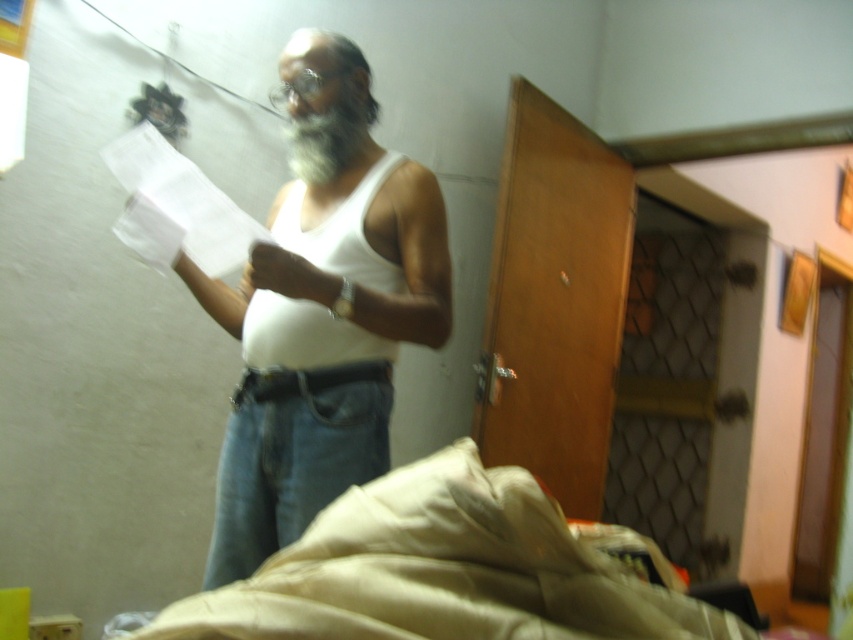
In the scene shown: Between beige fabric bed at lower center and matte white hand at center, which one appears on the right side from the viewer's perspective?

From the viewer's perspective, beige fabric bed at lower center appears more on the right side.

Find the location of a particular element. Image resolution: width=853 pixels, height=640 pixels. beige fabric bed at lower center is located at coordinates (451, 570).

Where is `beige fabric bed at lower center`? The image size is (853, 640). beige fabric bed at lower center is located at coordinates [451, 570].

Does beige fabric bed at lower center have a larger size compared to white paper at center?

Correct, beige fabric bed at lower center is larger in size than white paper at center.

You are a GUI agent. You are given a task and a screenshot of the screen. Output one action in this format:
    pyautogui.click(x=<x>, y=<y>)
    Task: Click on the beige fabric bed at lower center
    
    Given the screenshot: What is the action you would take?
    pos(451,570)

Can you confirm if white matte tank top at center is positioned to the left of matte white hand at center?

In fact, white matte tank top at center is to the right of matte white hand at center.

Which is behind, point (250, 561) or point (260, 280)?

Point (250, 561)

Where is `white matte tank top at center`? white matte tank top at center is located at coordinates (323, 310).